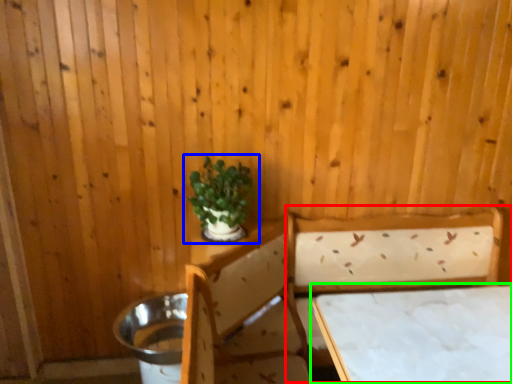
Question: Which object is positioned farthest from bed (highlighted by a red box)? Select from houseplant (highlighted by a blue box) and table (highlighted by a green box).

Choices:
 (A) houseplant
 (B) table

Answer: (A)